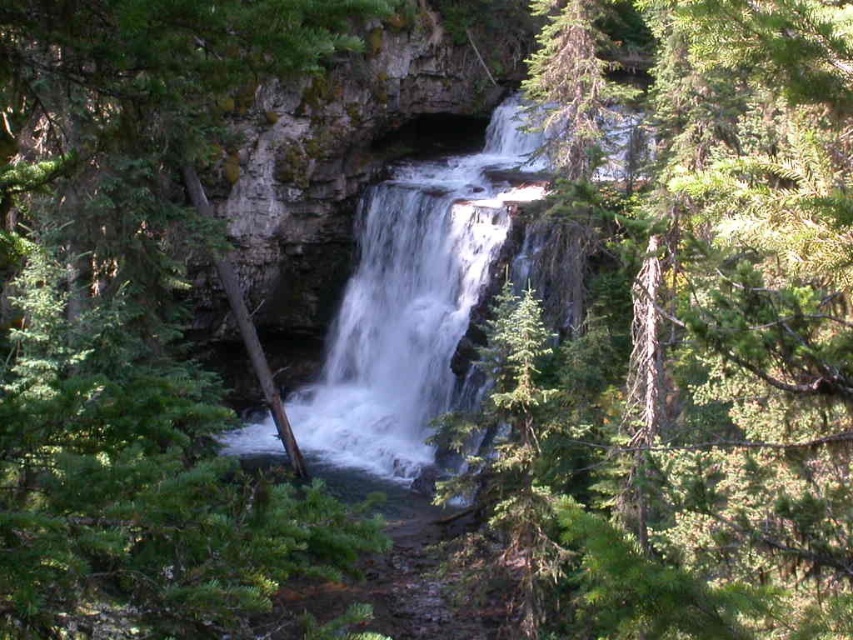
You are standing at the viewpoint of the image and want to know how far you are from the point marked as point (78,232). Can you determine the distance?

The distance between you and point (78,232) is 14.16 meters.

You are a photographer standing at the edge of the cliff near the waterfall. You want to capture a closeup shot of the green textured tree at center. Your camera has a maximum focus range of 2.5 meters. Is the tree within your camera focus range?

The distance between the green textured tree at center and the camera is 2.79 meters, which exceeds the camera maximum focus range of 2.5 meters. Therefore, the tree is out of focus range.

Consider the image. You are standing at the base of the waterfall and want to take a photo of the green textured tree at center without getting it wet. Since the white frothy water at center is spraying downwards, will the tree be safe from the water spray?

The green textured tree at center is positioned under white frothy water at center, so it will likely get wet from the spray. To avoid getting the tree wet in your photo, you might need to adjust your angle or move to a position where the spray doesn